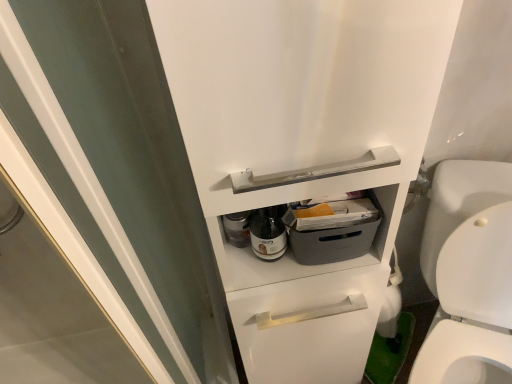
Measure the distance between translucent glass bottle at center and camera.

A distance of 69.20 centimeters exists between translucent glass bottle at center and camera.

At what (x,y) coordinates should I click in order to perform the action: click on translucent glass bottle at center. Please return your answer as a coordinate pair (x, y). Looking at the image, I should click on (268, 234).

Identify the location of toilet on the right of transparent glass screen door at upper left. (469, 274).

From a real-world perspective, who is located lower, transparent glass screen door at upper left or white glossy toilet at right?

white glossy toilet at right, from a real-world perspective.

Can you confirm if transparent glass screen door at upper left is positioned to the left of white glossy toilet at right?

Yes, transparent glass screen door at upper left is to the left of white glossy toilet at right.

How many degrees apart are the facing directions of transparent glass screen door at upper left and white glossy toilet at right?

The facing directions of transparent glass screen door at upper left and white glossy toilet at right are 25.5 degrees apart.

Considering the sizes of objects translucent glass bottle at center and transparent glass screen door at upper left in the image provided, who is taller, translucent glass bottle at center or transparent glass screen door at upper left?

transparent glass screen door at upper left is taller.

Between point (260, 215) and point (88, 177), which one is positioned in front?

The point (88, 177) is more forward.

In the scene shown: How many degrees apart are the facing directions of translucent glass bottle at center and transparent glass screen door at upper left?

The facing directions of translucent glass bottle at center and transparent glass screen door at upper left are 0.0009 degrees apart.

In the scene shown: Is the depth of translucent glass bottle at center less than that of transparent glass screen door at upper left?

No, it is behind transparent glass screen door at upper left.

Which is correct: transparent glass screen door at upper left is inside translucent glass bottle at center, or outside of it?

transparent glass screen door at upper left is not inside translucent glass bottle at center, it's outside.

Is point (182, 377) farther from camera compared to point (272, 255)?

That is True.

Considering the sizes of objects transparent glass screen door at upper left and translucent glass bottle at center in the image provided, who is shorter, transparent glass screen door at upper left or translucent glass bottle at center?

Answer: translucent glass bottle at center.

Can you confirm if white glossy toilet at right is thinner than translucent glass bottle at center?

Incorrect, the width of white glossy toilet at right is not less than that of translucent glass bottle at center.

Considering the relative positions of white glossy toilet at right and translucent glass bottle at center in the image provided, is white glossy toilet at right to the left or to the right of translucent glass bottle at center?

Clearly, white glossy toilet at right is on the right of translucent glass bottle at center in the image.

Is white glossy toilet at right oriented away from translucent glass bottle at center?

That's not correct — white glossy toilet at right is not looking away from translucent glass bottle at center.

Is translucent glass bottle at center positioned far away from white glossy toilet at right?

That's not correct — translucent glass bottle at center is a little close to white glossy toilet at right.

Is translucent glass bottle at center turned away from white glossy toilet at right?

No, translucent glass bottle at center is not facing the opposite direction of white glossy toilet at right.

Which of these two, translucent glass bottle at center or white glossy toilet at right, is bigger?

With larger size is white glossy toilet at right.

In the scene shown: In the image, is translucent glass bottle at center positioned in front of or behind white glossy toilet at right?

Clearly, translucent glass bottle at center is behind white glossy toilet at right.

Which is closer, (x=452, y=263) or (x=60, y=62)?

Point (x=452, y=263) appears to be farther away from the viewer than point (x=60, y=62).

Who is smaller, white glossy toilet at right or transparent glass screen door at upper left?

Smaller between the two is transparent glass screen door at upper left.

Is the depth of white glossy toilet at right less than that of transparent glass screen door at upper left?

No, white glossy toilet at right is further to the viewer.

At what (x,y) coordinates should I click in order to perform the action: click on toilet below the transparent glass screen door at upper left (from the image's perspective). Please return your answer as a coordinate pair (x, y). Looking at the image, I should click on (469, 274).

The width and height of the screenshot is (512, 384). Find the location of `bottle that is above the transparent glass screen door at upper left (from a real-world perspective)`. bottle that is above the transparent glass screen door at upper left (from a real-world perspective) is located at coordinates (268, 234).

Based on their spatial positions, is transparent glass screen door at upper left or white glossy toilet at right further from translucent glass bottle at center?

Among the two, white glossy toilet at right is located further to translucent glass bottle at center.

Based on their spatial positions, is translucent glass bottle at center or transparent glass screen door at upper left further from white glossy toilet at right?

transparent glass screen door at upper left is positioned further to the anchor white glossy toilet at right.

Looking at the image, which one is located further to white glossy toilet at right, transparent glass screen door at upper left or translucent glass bottle at center?

transparent glass screen door at upper left lies further to white glossy toilet at right than the other object.

From the image, which object appears to be nearer to transparent glass screen door at upper left, white glossy toilet at right or translucent glass bottle at center?

The object closer to transparent glass screen door at upper left is translucent glass bottle at center.

Considering their positions, is white glossy toilet at right positioned further to translucent glass bottle at center than transparent glass screen door at upper left?

white glossy toilet at right is positioned further to the anchor translucent glass bottle at center.

From the picture: From the image, which object appears to be farther from transparent glass screen door at upper left, translucent glass bottle at center or white glossy toilet at right?

white glossy toilet at right.

I want to click on bottle located between transparent glass screen door at upper left and white glossy toilet at right in the left-right direction, so click(268, 234).